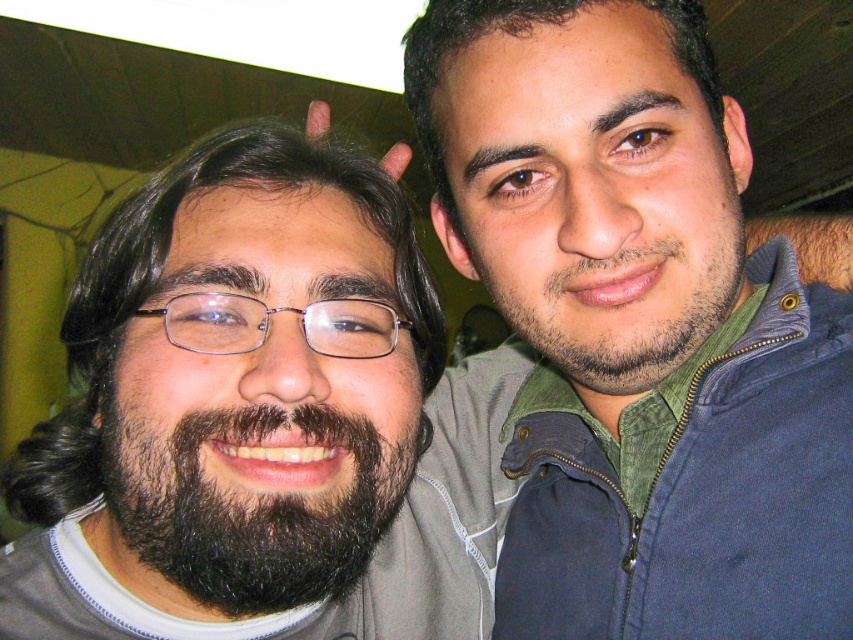
Question: Which point is closer to the camera?

Choices:
 (A) (426, 76)
 (B) (167, 536)

Answer: (B)

Question: Considering the real-world distances, which object is closest to the black fuzzy beard at left?

Choices:
 (A) dark brown stubble at center
 (B) dark blue zip-up jacket at center

Answer: (A)

Question: Which point appears farthest from the camera in this image?

Choices:
 (A) tap(553, 100)
 (B) tap(306, 406)

Answer: (A)

Question: Is dark brown hair at center bigger than dark brown stubble at center?

Choices:
 (A) yes
 (B) no

Answer: (A)

Question: Considering the relative positions of dark blue zip-up jacket at center and black fuzzy beard at left in the image provided, where is dark blue zip-up jacket at center located with respect to black fuzzy beard at left?

Choices:
 (A) right
 (B) left

Answer: (A)

Question: From the image, what is the correct spatial relationship of dark blue zip-up jacket at center in relation to dark brown hair at center?

Choices:
 (A) left
 (B) right

Answer: (B)